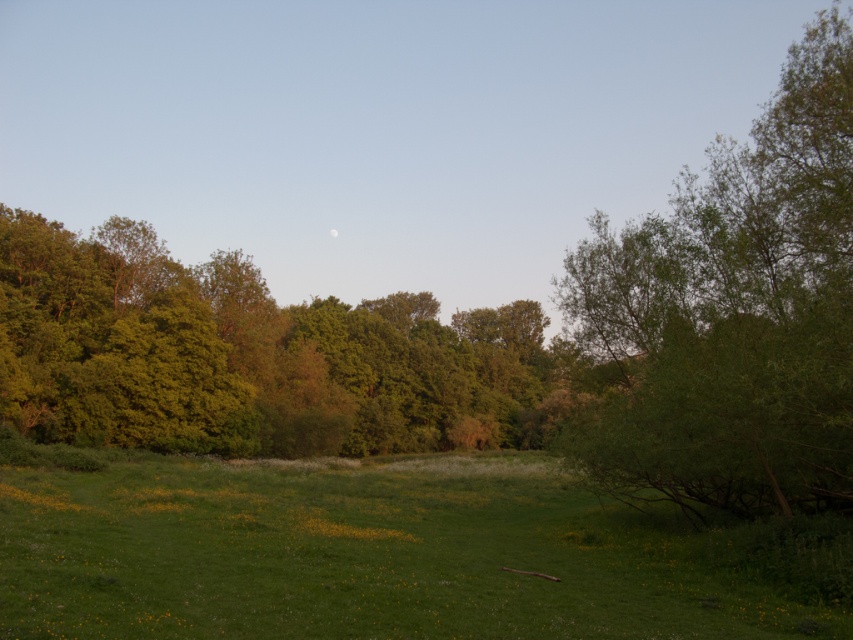
You are standing in the middle of the green grassy field at center and the green leafy tree at center. Which object takes up more horizontal space in the image?

The green leafy tree at center takes up more horizontal space than the green grassy field at center because the green grassy field at center has a smaller width.

You are standing in the serene landscape and want to walk from the green grassy field at center to the green leafy tree at right. Which direction should you move to reach the tree?

You should move to your right since the green leafy tree at right is to the right of the green grassy field at center.